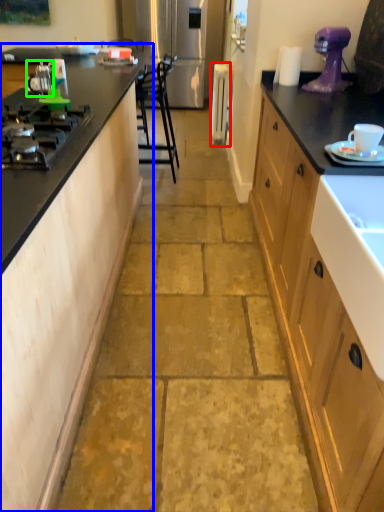
Question: Estimate the real-world distances between objects in this image. Which object is closer to appliance (highlighted by a red box), cabinetry (highlighted by a blue box) or appliance (highlighted by a green box)?

Choices:
 (A) cabinetry
 (B) appliance

Answer: (B)